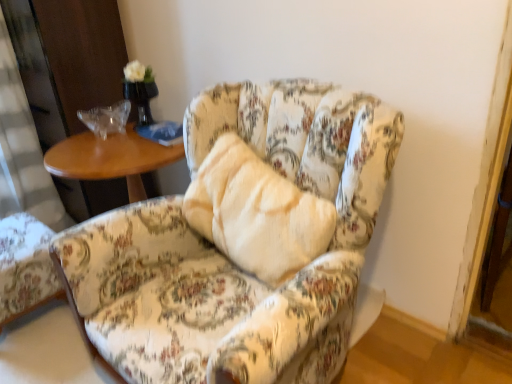
Locate an element on the screen. floral fabric armchair at lower left, which ranks as the 1th chair in left-to-right order is located at coordinates (25, 266).

How much space does floral fabric armchair at lower left, which ranks as the 1th chair in left-to-right order, occupy vertically?

floral fabric armchair at lower left, which ranks as the 1th chair in left-to-right order, is 14.15 inches tall.

What do you see at coordinates (25, 266) in the screenshot? Image resolution: width=512 pixels, height=384 pixels. I see `floral fabric armchair at lower left, the 2th chair in the right-to-left sequence` at bounding box center [25, 266].

The height and width of the screenshot is (384, 512). Identify the location of floral fabric chair at center, placed as the first chair when sorted from right to left. (242, 241).

Describe the element at coordinates (242, 241) in the screenshot. The height and width of the screenshot is (384, 512). I see `floral fabric chair at center, marked as the 2th chair in a left-to-right arrangement` at that location.

At what (x,y) coordinates should I click in order to perform the action: click on floral fabric armchair at lower left, which ranks as the 1th chair in left-to-right order. Please return your answer as a coordinate pair (x, y). Looking at the image, I should click on (25, 266).

Can you confirm if floral fabric chair at center, marked as the 2th chair in a left-to-right arrangement, is positioned to the left of floral fabric armchair at lower left, the 2th chair in the right-to-left sequence?

No, floral fabric chair at center, marked as the 2th chair in a left-to-right arrangement, is not to the left of floral fabric armchair at lower left, the 2th chair in the right-to-left sequence.

Considering their positions, is floral fabric chair at center, marked as the 2th chair in a left-to-right arrangement, located in front of or behind floral fabric armchair at lower left, the 2th chair in the right-to-left sequence?

Clearly, floral fabric chair at center, marked as the 2th chair in a left-to-right arrangement, is in front of floral fabric armchair at lower left, the 2th chair in the right-to-left sequence.

Which is in front, point (343, 303) or point (49, 281)?

The point (343, 303) is in front.

From the image's perspective, is floral fabric chair at center, placed as the first chair when sorted from right to left, located above floral fabric armchair at lower left, the 2th chair in the right-to-left sequence?

Yes.

From a real-world perspective, is floral fabric chair at center, placed as the first chair when sorted from right to left, beneath floral fabric armchair at lower left, the 2th chair in the right-to-left sequence?

No, from a real-world perspective, floral fabric chair at center, placed as the first chair when sorted from right to left, is not beneath floral fabric armchair at lower left, the 2th chair in the right-to-left sequence.

Which of these two, floral fabric chair at center, placed as the first chair when sorted from right to left, or floral fabric armchair at lower left, the 2th chair in the right-to-left sequence, is thinner?

floral fabric armchair at lower left, the 2th chair in the right-to-left sequence, is thinner.

Is floral fabric chair at center, marked as the 2th chair in a left-to-right arrangement, taller or shorter than floral fabric armchair at lower left, which ranks as the 1th chair in left-to-right order?

Considering their sizes, floral fabric chair at center, marked as the 2th chair in a left-to-right arrangement, has more height than floral fabric armchair at lower left, which ranks as the 1th chair in left-to-right order.

Which of these two, floral fabric chair at center, placed as the first chair when sorted from right to left, or floral fabric armchair at lower left, the 2th chair in the right-to-left sequence, is smaller?

floral fabric armchair at lower left, the 2th chair in the right-to-left sequence.

Is floral fabric chair at center, marked as the 2th chair in a left-to-right arrangement, located outside floral fabric armchair at lower left, the 2th chair in the right-to-left sequence?

floral fabric chair at center, marked as the 2th chair in a left-to-right arrangement, lies outside floral fabric armchair at lower left, the 2th chair in the right-to-left sequence,'s area.

Is there a large distance between floral fabric chair at center, placed as the first chair when sorted from right to left, and floral fabric armchair at lower left, which ranks as the 1th chair in left-to-right order?

No, there isn't a large distance between floral fabric chair at center, placed as the first chair when sorted from right to left, and floral fabric armchair at lower left, which ranks as the 1th chair in left-to-right order.

Could you tell me if floral fabric chair at center, marked as the 2th chair in a left-to-right arrangement, is facing floral fabric armchair at lower left, the 2th chair in the right-to-left sequence?

No, floral fabric chair at center, marked as the 2th chair in a left-to-right arrangement, is not facing towards floral fabric armchair at lower left, the 2th chair in the right-to-left sequence.

What's the angular difference between floral fabric chair at center, marked as the 2th chair in a left-to-right arrangement, and floral fabric armchair at lower left, which ranks as the 1th chair in left-to-right order,'s facing directions?

floral fabric chair at center, marked as the 2th chair in a left-to-right arrangement, and floral fabric armchair at lower left, which ranks as the 1th chair in left-to-right order, are facing 177 degrees away from each other.

At what (x,y) coordinates should I click in order to perform the action: click on chair located above the floral fabric armchair at lower left, the 2th chair in the right-to-left sequence (from a real-world perspective). Please return your answer as a coordinate pair (x, y). Image resolution: width=512 pixels, height=384 pixels. Looking at the image, I should click on (242, 241).

Is floral fabric armchair at lower left, the 2th chair in the right-to-left sequence, at the left side of floral fabric chair at center, marked as the 2th chair in a left-to-right arrangement?

Correct, you'll find floral fabric armchair at lower left, the 2th chair in the right-to-left sequence, to the left of floral fabric chair at center, marked as the 2th chair in a left-to-right arrangement.

Considering the positions of objects floral fabric armchair at lower left, which ranks as the 1th chair in left-to-right order, and floral fabric chair at center, marked as the 2th chair in a left-to-right arrangement, in the image provided, who is behind, floral fabric armchair at lower left, which ranks as the 1th chair in left-to-right order, or floral fabric chair at center, marked as the 2th chair in a left-to-right arrangement,?

floral fabric armchair at lower left, which ranks as the 1th chair in left-to-right order, is behind.

Considering the points (11, 246) and (367, 218), which point is behind, point (11, 246) or point (367, 218)?

The point (11, 246) is more distant.

From the picture: From the image's perspective, is floral fabric armchair at lower left, which ranks as the 1th chair in left-to-right order, on floral fabric chair at center, marked as the 2th chair in a left-to-right arrangement?

No, from the image's perspective, floral fabric armchair at lower left, which ranks as the 1th chair in left-to-right order, is not on top of floral fabric chair at center, marked as the 2th chair in a left-to-right arrangement.

From a real-world perspective, does floral fabric armchair at lower left, which ranks as the 1th chair in left-to-right order, sit lower than floral fabric chair at center, marked as the 2th chair in a left-to-right arrangement?

Yes, from a real-world perspective, floral fabric armchair at lower left, which ranks as the 1th chair in left-to-right order, is beneath floral fabric chair at center, marked as the 2th chair in a left-to-right arrangement.

Between floral fabric armchair at lower left, the 2th chair in the right-to-left sequence, and floral fabric chair at center, marked as the 2th chair in a left-to-right arrangement, which one has larger width?

Wider between the two is floral fabric chair at center, marked as the 2th chair in a left-to-right arrangement.

Considering the relative sizes of floral fabric armchair at lower left, the 2th chair in the right-to-left sequence, and floral fabric chair at center, marked as the 2th chair in a left-to-right arrangement, in the image provided, is floral fabric armchair at lower left, the 2th chair in the right-to-left sequence, shorter than floral fabric chair at center, marked as the 2th chair in a left-to-right arrangement,?

Yes, floral fabric armchair at lower left, the 2th chair in the right-to-left sequence, is shorter than floral fabric chair at center, marked as the 2th chair in a left-to-right arrangement.

Considering the relative sizes of floral fabric armchair at lower left, the 2th chair in the right-to-left sequence, and floral fabric chair at center, placed as the first chair when sorted from right to left, in the image provided, is floral fabric armchair at lower left, the 2th chair in the right-to-left sequence, bigger than floral fabric chair at center, placed as the first chair when sorted from right to left,?

Incorrect, floral fabric armchair at lower left, the 2th chair in the right-to-left sequence, is not larger than floral fabric chair at center, placed as the first chair when sorted from right to left.

Is floral fabric armchair at lower left, the 2th chair in the right-to-left sequence, located outside floral fabric chair at center, marked as the 2th chair in a left-to-right arrangement?

Yes, floral fabric armchair at lower left, the 2th chair in the right-to-left sequence, is not within floral fabric chair at center, marked as the 2th chair in a left-to-right arrangement.

Is floral fabric armchair at lower left, the 2th chair in the right-to-left sequence, next to floral fabric chair at center, marked as the 2th chair in a left-to-right arrangement?

No, floral fabric armchair at lower left, the 2th chair in the right-to-left sequence, is not making contact with floral fabric chair at center, marked as the 2th chair in a left-to-right arrangement.

Is floral fabric armchair at lower left, the 2th chair in the right-to-left sequence, facing towards floral fabric chair at center, placed as the first chair when sorted from right to left?

No.

This screenshot has width=512, height=384. What are the coordinates of `chair located underneath the floral fabric chair at center, placed as the first chair when sorted from right to left (from a real-world perspective)` in the screenshot? It's located at (25, 266).

Locate an element on the screen. The height and width of the screenshot is (384, 512). chair to the right of floral fabric armchair at lower left, the 2th chair in the right-to-left sequence is located at coordinates (242, 241).

At what (x,y) coordinates should I click in order to perform the action: click on chair that appears on the left of floral fabric chair at center, marked as the 2th chair in a left-to-right arrangement. Please return your answer as a coordinate pair (x, y). The image size is (512, 384). Looking at the image, I should click on (25, 266).